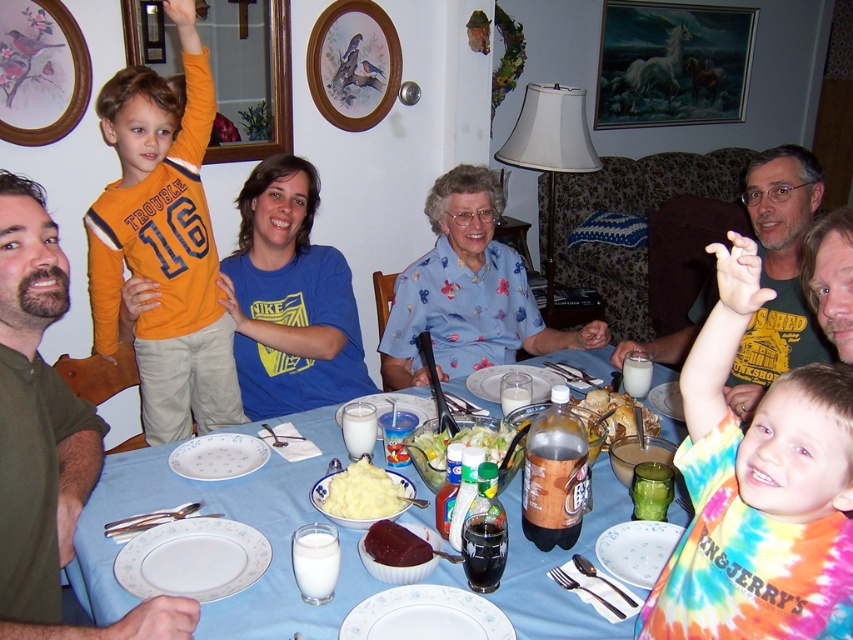
You are a guest at this family gathering and want to place your napkin on the white ceramic plate at lower center. Given that the coordinates of the plate are point (636, 548), can you confirm if this plate is located at the lower half of the table?

Yes, the white ceramic plate at lower center is located at the lower half of the table as indicated by its coordinates point (636, 548).

Looking at this image, you are a guest at this family gathering and want to place your napkin on the table. You have a napkin that is 20 cm wide. Which object, the white porcelain plate at lower left or the dark red meat at center, would allow your napkin to fit without hanging over the edge?

The white porcelain plate at lower left might be wider than dark red meat at center. Since the napkin is 20 cm wide, if the plate is wider than 20 cm, the napkin would fit. However, without exact measurements, it is uncertain. You might want to check the plate size first.

You are a guest at this dinner and want to reach for the green leafy salad at center without knocking anything over. Since the white ceramic plate at lower center is in the way, how might you adjust your arm movement to safely reach the salad?

The white ceramic plate at lower center is shorter than the green leafy salad at center, so you can carefully move your arm around the plate to reach the salad without knocking it over.